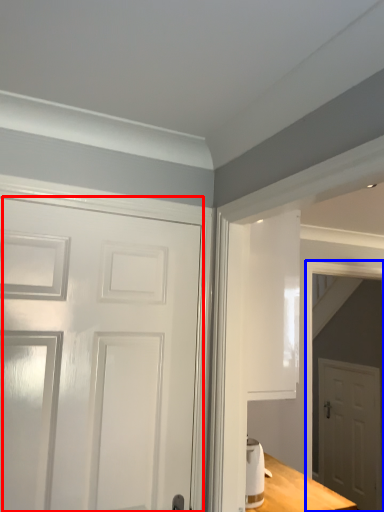
Question: Which of the following is the closest to the observer, door (highlighted by a red box) or elevator (highlighted by a blue box)?

Choices:
 (A) door
 (B) elevator

Answer: (A)